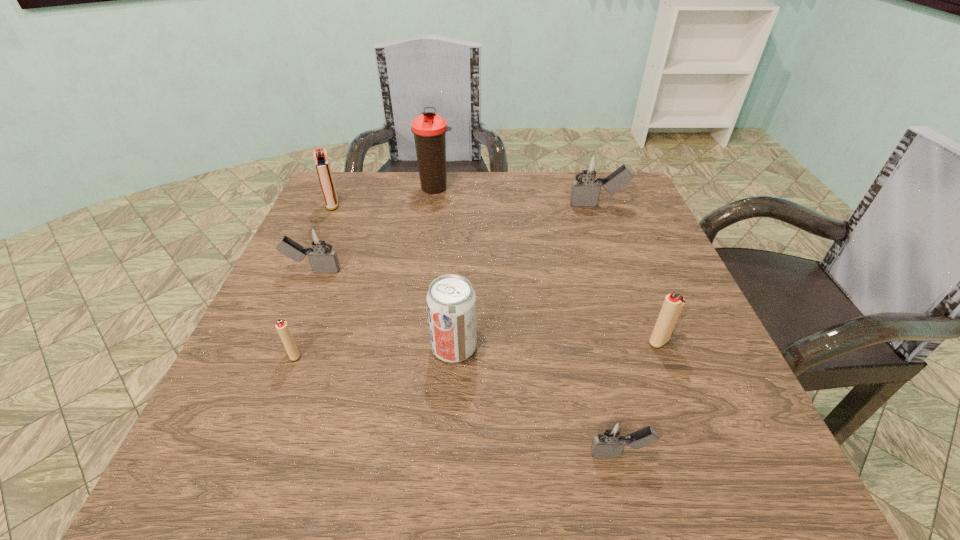
Find the location of a particular element. vacant area between the soda can and the fourth nearest igniter is located at coordinates (384, 308).

I want to click on unoccupied area between the second biggest red igniter and the thermos bottle, so click(x=547, y=265).

Locate an element on the screen. This screenshot has width=960, height=540. vacant region between the tallest object and the second smallest red igniter is located at coordinates (547, 265).

The height and width of the screenshot is (540, 960). Find the location of `vacant area that lies between the nearest igniter and the rightmost red igniter`. vacant area that lies between the nearest igniter and the rightmost red igniter is located at coordinates (639, 397).

You are a GUI agent. You are given a task and a screenshot of the screen. Output one action in this format:
    pyautogui.click(x=<x>, y=<y>)
    Task: Click on the vacant space in between the brown thermos bottle and the nearest object
    The height and width of the screenshot is (540, 960).
    Given the screenshot: What is the action you would take?
    528,321

The width and height of the screenshot is (960, 540). I want to click on free spot between the farthest gray igniter and the tallest object, so click(x=516, y=196).

Image resolution: width=960 pixels, height=540 pixels. Identify the location of empty location between the farthest red igniter and the soda can. (394, 276).

Where is `object that is the fifth closest to the second red igniter from left to right`? object that is the fifth closest to the second red igniter from left to right is located at coordinates (429, 129).

Find the location of a particular element. the second closest object to the soda can is located at coordinates (281, 325).

This screenshot has width=960, height=540. I want to click on the fifth closest igniter to the farthest gray igniter, so click(281, 325).